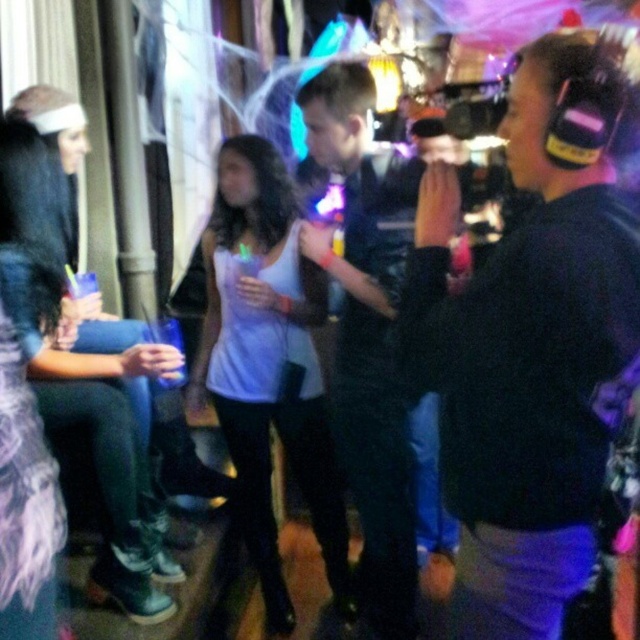
Can you confirm if white matte tank top at center is positioned to the left of matte white tank top at center?

No, white matte tank top at center is not to the left of matte white tank top at center.

Can you confirm if white matte tank top at center is positioned above matte white tank top at center?

No.

Where is `white matte tank top at center`? The image size is (640, 640). white matte tank top at center is located at coordinates (268, 364).

In order to click on white matte tank top at center in this screenshot , I will do coord(268,364).

Who is taller, white matte tank top at center or black leather jacket at center?

black leather jacket at center

Does white matte tank top at center have a lesser height compared to black leather jacket at center?

Yes.

Identify the location of white matte tank top at center. (268, 364).

Locate an element on the screen. white matte tank top at center is located at coordinates (268, 364).

The height and width of the screenshot is (640, 640). I want to click on black matte headphones at right, so click(x=531, y=340).

Does black matte headphones at right appear on the right side of white matte tank top at center?

Indeed, black matte headphones at right is positioned on the right side of white matte tank top at center.

Does point (500, 588) come in front of point (312, 499)?

Yes, point (500, 588) is closer to viewer.

Identify the location of black matte headphones at right. This screenshot has width=640, height=640. pyautogui.click(x=531, y=340).